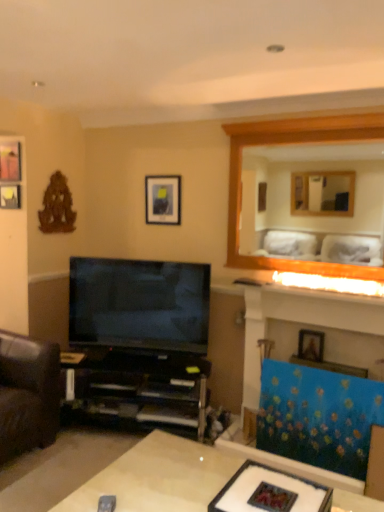
The width and height of the screenshot is (384, 512). What do you see at coordinates (139, 389) in the screenshot?
I see `black plastic shelf at lower left` at bounding box center [139, 389].

Measure the distance between matte black picture frame at upper left, arranged as the third picture frame when viewed from the right, and camera.

10.26 feet.

This screenshot has width=384, height=512. Describe the element at coordinates (159, 477) in the screenshot. I see `white glossy table at lower center` at that location.

Locate an element on the screen. This screenshot has height=512, width=384. matte black picture frame at upper left, which is the 2th picture frame from top to bottom is located at coordinates point(10,196).

Locate an element on the screen. The height and width of the screenshot is (512, 384). wooden mirror at upper right is located at coordinates (314, 201).

At what (x,y) coordinates should I click in order to perform the action: click on blue textured fabric at lower right. Please return your answer as a coordinate pair (x, y). Looking at the image, I should click on (318, 416).

Measure the distance between point [289,400] and camera.

They are 2.70 meters apart.

The height and width of the screenshot is (512, 384). What are the coordinates of `black plastic shelf at lower left` in the screenshot? It's located at (139, 389).

Identify the location of mirror above the blue textured fabric at lower right (from a real-world perspective). (314, 201).

Considering the sizes of objects blue textured fabric at lower right and wooden mirror at upper right in the image provided, who is smaller, blue textured fabric at lower right or wooden mirror at upper right?

blue textured fabric at lower right.

In the scene shown: Considering the relative sizes of blue textured fabric at lower right and wooden mirror at upper right in the image provided, is blue textured fabric at lower right shorter than wooden mirror at upper right?

Yes.

From the image's perspective, would you say blue textured fabric at lower right is positioned over wooden mirror at upper right?

Actually, blue textured fabric at lower right appears below wooden mirror at upper right in the image.

Considering the positions of objects matte black picture frame at upper left, which is the third picture frame in front-to-back order, and matte black picture frame at upper center, the second picture frame in the right-to-left sequence, in the image provided, who is more to the right, matte black picture frame at upper left, which is the third picture frame in front-to-back order, or matte black picture frame at upper center, the second picture frame in the right-to-left sequence,?

matte black picture frame at upper center, the second picture frame in the right-to-left sequence, is more to the right.

The width and height of the screenshot is (384, 512). I want to click on the 2nd picture frame counting from the right of the matte black picture frame at upper left, the 4th picture frame in the right-to-left sequence, so click(x=163, y=200).

Is the position of matte black picture frame at upper left, the 4th picture frame in the right-to-left sequence, less distant than that of matte black picture frame at upper center, which is counted as the 3th picture frame, starting from the left?

Yes, matte black picture frame at upper left, the 4th picture frame in the right-to-left sequence, is closer to the camera.

Can you confirm if matte black picture frame at upper left, which is the third picture frame in front-to-back order, is wider than matte black picture frame at upper center, the second picture frame in the right-to-left sequence?

No, matte black picture frame at upper left, which is the third picture frame in front-to-back order, is not wider than matte black picture frame at upper center, the second picture frame in the right-to-left sequence.

From the image's perspective, is matte black picture frame at upper left, the third picture frame positioned from the back, under white glossy table at lower center?

Incorrect, from the image's perspective, matte black picture frame at upper left, the third picture frame positioned from the back, is higher than white glossy table at lower center.

Which of these two, matte black picture frame at upper left, the 2th picture frame in the front-to-back sequence, or white glossy table at lower center, stands shorter?

matte black picture frame at upper left, the 2th picture frame in the front-to-back sequence.

Does matte black picture frame at upper left, the 2th picture frame in the front-to-back sequence, turn towards white glossy table at lower center?

No, matte black picture frame at upper left, the 2th picture frame in the front-to-back sequence, does not turn towards white glossy table at lower center.

Identify the location of table that is below the matte black picture frame at upper left, the 4th picture frame in the bottom-to-top sequence (from the image's perspective). Image resolution: width=384 pixels, height=512 pixels. (159, 477).

Which is less distant, (73,327) or (88,352)?

Positioned in front is point (88,352).

Find the location of a particular element. This screenshot has height=512, width=384. shelf that is under the matte black tv at center (from a real-world perspective) is located at coordinates (139, 389).

How different are the orientations of matte black tv at center and black plastic shelf at lower left in degrees?

The angular difference between matte black tv at center and black plastic shelf at lower left is 1.65 degrees.

Who is shorter, matte black tv at center or black plastic shelf at lower left?

black plastic shelf at lower left is shorter.

Between matte black picture frame at upper left, the 2th picture frame in the front-to-back sequence, and blue textured fabric at lower right, which one appears on the left side from the viewer's perspective?

matte black picture frame at upper left, the 2th picture frame in the front-to-back sequence, is more to the left.

Can you confirm if matte black picture frame at upper left, arranged as the third picture frame when viewed from the right, is shorter than blue textured fabric at lower right?

Yes, matte black picture frame at upper left, arranged as the third picture frame when viewed from the right, is shorter than blue textured fabric at lower right.

Is the depth of matte black picture frame at upper left, the 2th picture frame in the front-to-back sequence, less than that of blue textured fabric at lower right?

No, the depth of matte black picture frame at upper left, the 2th picture frame in the front-to-back sequence, is greater than that of blue textured fabric at lower right.

Is matte black picture frame at upper left, arranged as the third picture frame when viewed from the right, wider or thinner than blue textured fabric at lower right?

In the image, matte black picture frame at upper left, arranged as the third picture frame when viewed from the right, appears to be more narrow than blue textured fabric at lower right.

Considering their positions, is matte glass frame at center located in front of or behind wooden mirror at upper right?

matte glass frame at center is positioned closer to the viewer than wooden mirror at upper right.

Is matte glass frame at center at the left side of wooden mirror at upper right?

Indeed, matte glass frame at center is positioned on the left side of wooden mirror at upper right.

Is wooden mirror at upper right a part of matte glass frame at center?

That's incorrect, wooden mirror at upper right is not inside matte glass frame at center.

Which is nearer, (x=240, y=503) or (x=331, y=146)?

The point (x=240, y=503) is in front.

From a real-world perspective, is wooden mirror at upper right on top of matte black picture frame at upper left, the 4th picture frame in the right-to-left sequence?

Indeed, from a real-world perspective, wooden mirror at upper right stands above matte black picture frame at upper left, the 4th picture frame in the right-to-left sequence.

Is wooden mirror at upper right next to matte black picture frame at upper left, the third picture frame positioned from the bottom?

No, wooden mirror at upper right is not making contact with matte black picture frame at upper left, the third picture frame positioned from the bottom.

Which of these two, wooden mirror at upper right or matte black picture frame at upper left, which is the third picture frame in front-to-back order, is bigger?

wooden mirror at upper right is bigger.

Between wooden mirror at upper right and matte black picture frame at upper left, which is the third picture frame in front-to-back order, which one has smaller width?

With smaller width is matte black picture frame at upper left, which is the third picture frame in front-to-back order.

You are a GUI agent. You are given a task and a screenshot of the screen. Output one action in this format:
    pyautogui.click(x=<x>, y=<y>)
    Task: Click on the curtain below the wooden mirror at upper right (from a real-world perspective)
    This screenshot has height=512, width=384.
    Given the screenshot: What is the action you would take?
    pyautogui.click(x=318, y=416)

From the matte black picture frame at upper center, arranged as the third picture frame when viewed from the top, count the 2nd picture frame to the left and point to it. Please provide its 2D coordinates.

[(10, 196)]

Looking at the image, which one is located further to wooden picture frame at upper right, which ranks as the first picture frame in bottom-to-top order, white glossy table at lower center or blue textured fabric at lower right?

The object further to wooden picture frame at upper right, which ranks as the first picture frame in bottom-to-top order, is white glossy table at lower center.

From the image, which object appears to be farther from matte black picture frame at upper center, arranged as the third picture frame when viewed from the top, matte black picture frame at upper left, arranged as the third picture frame when viewed from the right, or black plastic shelf at lower left?

black plastic shelf at lower left is positioned further to the anchor matte black picture frame at upper center, arranged as the third picture frame when viewed from the top.

Considering their positions, is matte glass frame at center positioned further to white glossy table at lower center than matte black picture frame at upper left, which is the third picture frame in front-to-back order?

The object further to white glossy table at lower center is matte black picture frame at upper left, which is the third picture frame in front-to-back order.

When comparing their distances from wooden mirror at upper right, does matte glass frame at center or wooden picture frame at upper right, marked as the 4th picture frame in a top-to-bottom arrangement, seem closer?

wooden picture frame at upper right, marked as the 4th picture frame in a top-to-bottom arrangement, lies closer to wooden mirror at upper right than the other object.

Looking at this image, looking at the image, which one is located closer to white glossy table at lower center, black plastic shelf at lower left or matte glass frame at center?

matte glass frame at center lies closer to white glossy table at lower center than the other object.

Considering their positions, is white glossy table at lower center positioned further to wooden mirror at upper right than blue textured fabric at lower right?

The object further to wooden mirror at upper right is white glossy table at lower center.

In the scene shown: Based on their spatial positions, is matte black picture frame at upper center, which is counted as the 3th picture frame, starting from the left, or matte black picture frame at upper left, marked as the second picture frame in a back-to-front arrangement, closer to matte black tv at center?

The object closer to matte black tv at center is matte black picture frame at upper center, which is counted as the 3th picture frame, starting from the left.

Which object lies further to the anchor point wooden picture frame at upper right, which ranks as the first picture frame in bottom-to-top order, white glossy table at lower center or wooden mirror at upper right?

Among the two, wooden mirror at upper right is located further to wooden picture frame at upper right, which ranks as the first picture frame in bottom-to-top order.

The image size is (384, 512). In order to click on table between matte black picture frame at upper left, the 4th picture frame in the bottom-to-top sequence, and blue textured fabric at lower right from left to right in this screenshot , I will do `click(159, 477)`.

Where is `television situated between matte black picture frame at upper left, the third picture frame positioned from the bottom, and blue textured fabric at lower right from left to right`? This screenshot has width=384, height=512. television situated between matte black picture frame at upper left, the third picture frame positioned from the bottom, and blue textured fabric at lower right from left to right is located at coordinates (139, 304).

You are a GUI agent. You are given a task and a screenshot of the screen. Output one action in this format:
    pyautogui.click(x=<x>, y=<y>)
    Task: Click on the mirror between matte black tv at center and wooden picture frame at upper right, marked as the 4th picture frame in a top-to-bottom arrangement, in the horizontal direction
    Image resolution: width=384 pixels, height=512 pixels.
    Given the screenshot: What is the action you would take?
    pyautogui.click(x=314, y=201)

Where is `television between matte black picture frame at upper left, the third picture frame positioned from the bottom, and wooden mirror at upper right, in the horizontal direction`? This screenshot has height=512, width=384. television between matte black picture frame at upper left, the third picture frame positioned from the bottom, and wooden mirror at upper right, in the horizontal direction is located at coordinates (139, 304).